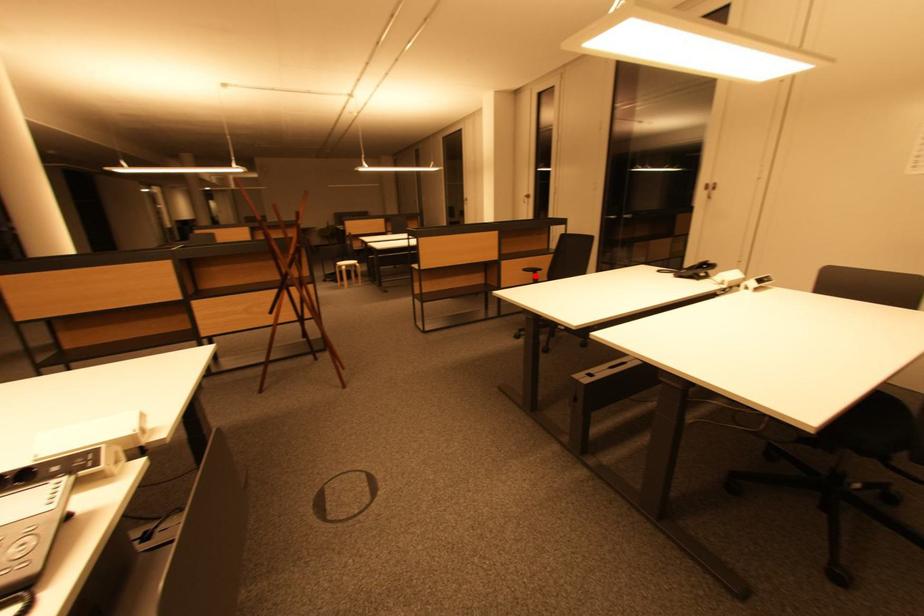
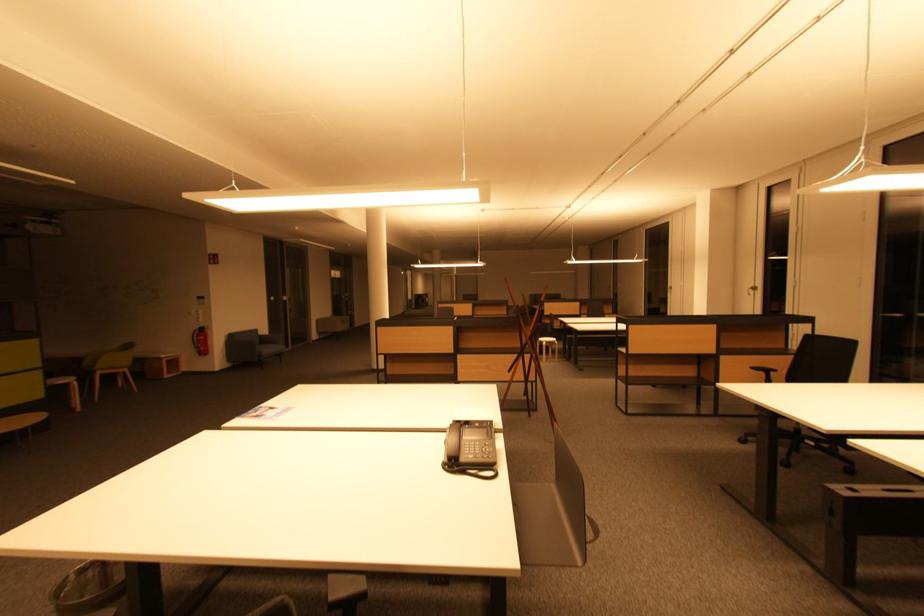
The point at the highlighted location is marked in the first image. Where is the corresponding point in the second image?

(767, 376)